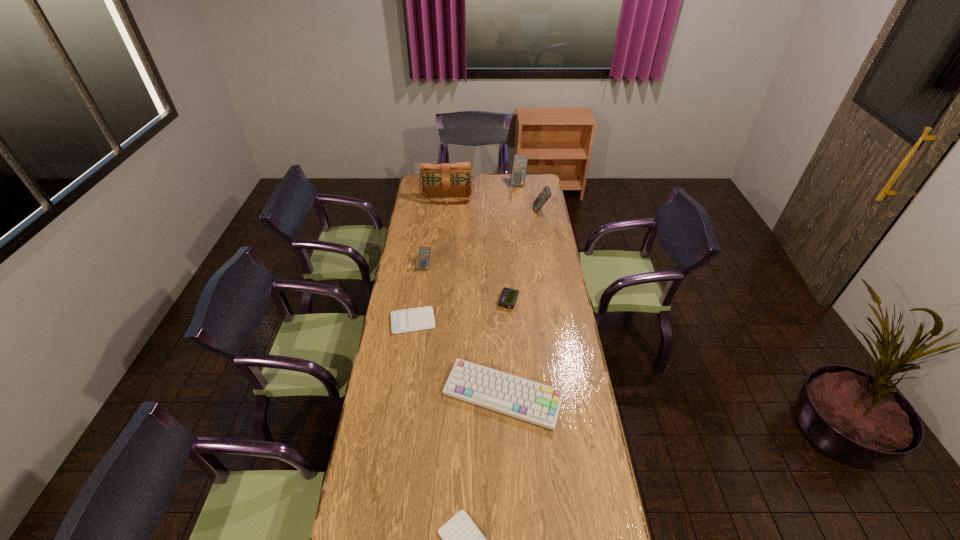
Where is `beeper`? beeper is located at coordinates (508, 297).

Find the location of a particular element. the second shortest calculator is located at coordinates (422, 318).

Locate an element on the screen. This screenshot has height=540, width=960. the second nearest calculator is located at coordinates (422, 318).

Find the location of a particular element. vacant area situated on the front-facing side of the seventh nearest object is located at coordinates (444, 231).

Where is `free space located on the front-facing side of the farthest blue calculator`? The image size is (960, 540). free space located on the front-facing side of the farthest blue calculator is located at coordinates (520, 205).

Locate an element on the screen. The image size is (960, 540). blank space located 0.080m on the front-facing side of the third farthest object is located at coordinates (519, 211).

Find the location of a particular element. vacant space located on the front-facing side of the third farthest object is located at coordinates (492, 211).

Image resolution: width=960 pixels, height=540 pixels. I want to click on free space located 0.330m on the front-facing side of the third farthest object, so click(478, 211).

Where is `vacant space located 0.330m on the front-facing side of the leftmost blue calculator`? The image size is (960, 540). vacant space located 0.330m on the front-facing side of the leftmost blue calculator is located at coordinates (418, 320).

Find the location of `vacant space located 0.060m on the right of the fifth tallest object`. vacant space located 0.060m on the right of the fifth tallest object is located at coordinates [x=579, y=396].